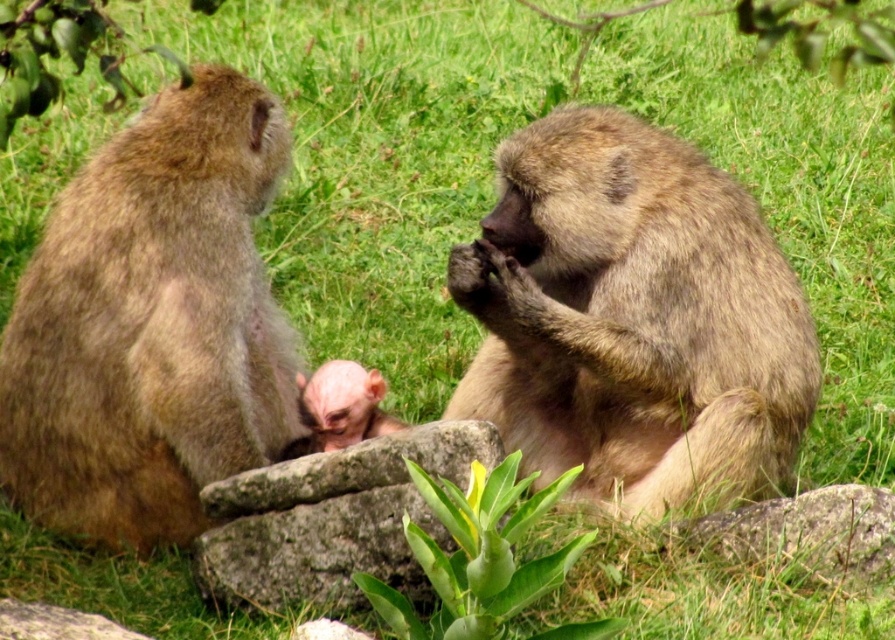
Does brown furry monkey at center have a greater width compared to gray stone at center?

Yes, brown furry monkey at center is wider than gray stone at center.

At what (x,y) coordinates should I click in order to perform the action: click on brown furry monkey at center. Please return your answer as a coordinate pair (x, y). Looking at the image, I should click on (633, 320).

Locate an element on the screen. The width and height of the screenshot is (895, 640). brown furry monkey at center is located at coordinates (633, 320).

Looking at this image, does brown furry monkey at left have a lesser width compared to gray stone at center?

Incorrect, brown furry monkey at left's width is not less than gray stone at center's.

Who is higher up, brown furry monkey at left or gray stone at center?

brown furry monkey at left

Is point (216, 472) farther from camera compared to point (327, 566)?

Yes.

The image size is (895, 640). I want to click on brown furry monkey at left, so click(152, 324).

Who is taller, gray stone at center or pink fur baby monkey at center?

gray stone at center is taller.

Which is above, gray stone at center or pink fur baby monkey at center?

Positioned higher is pink fur baby monkey at center.

Is point (237, 476) positioned after point (358, 433)?

No, it is in front of (358, 433).

At what (x,y) coordinates should I click in order to perform the action: click on gray stone at center. Please return your answer as a coordinate pair (x, y). The height and width of the screenshot is (640, 895). Looking at the image, I should click on (331, 518).